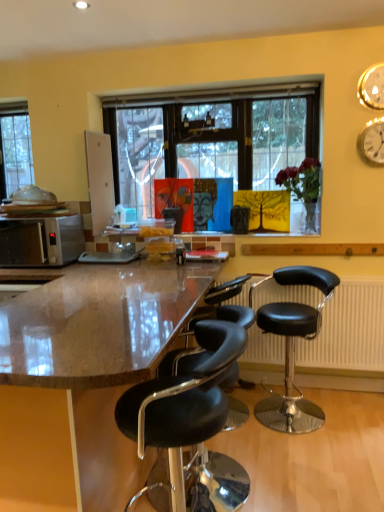
At what (x,y) coordinates should I click in order to perform the action: click on empty space that is ontop of black plastic radiator at lower right (from a real-world perspective). Please return your answer as a coordinate pair (x, y). The width and height of the screenshot is (384, 512). Looking at the image, I should click on (317, 272).